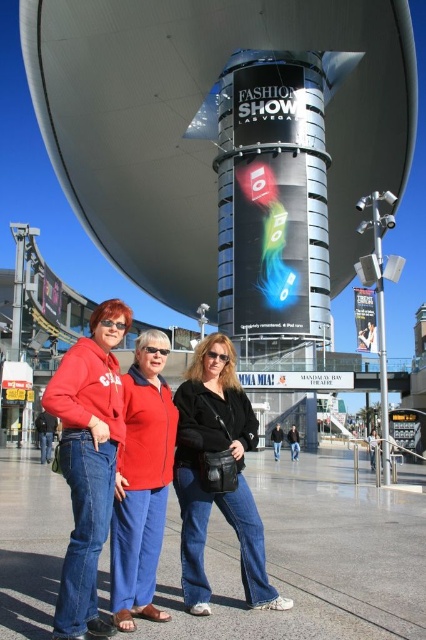
You are a fashion designer observing the crowd at the Fashion Show Mall. You notice two red garments at center. Which one is positioned lower between the matte red hoodie at center and the matte red jacket at center?

The matte red hoodie at center is positioned lower than the matte red jacket at center.

You are a photographer at the Fashion Show Mall in Las Vegas. You need to capture a photo of the matte red hoodie at center and the matte red jacket at center. According to the scene, which of these two items is positioned to the left?

The matte red hoodie at center is positioned to the left of the matte red jacket at center.